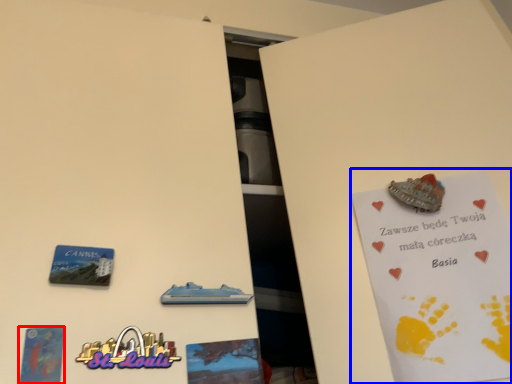
Question: Which object is further to the camera taking this photo, postcard (highlighted by a red box) or postcard (highlighted by a blue box)?

Choices:
 (A) postcard
 (B) postcard

Answer: (B)